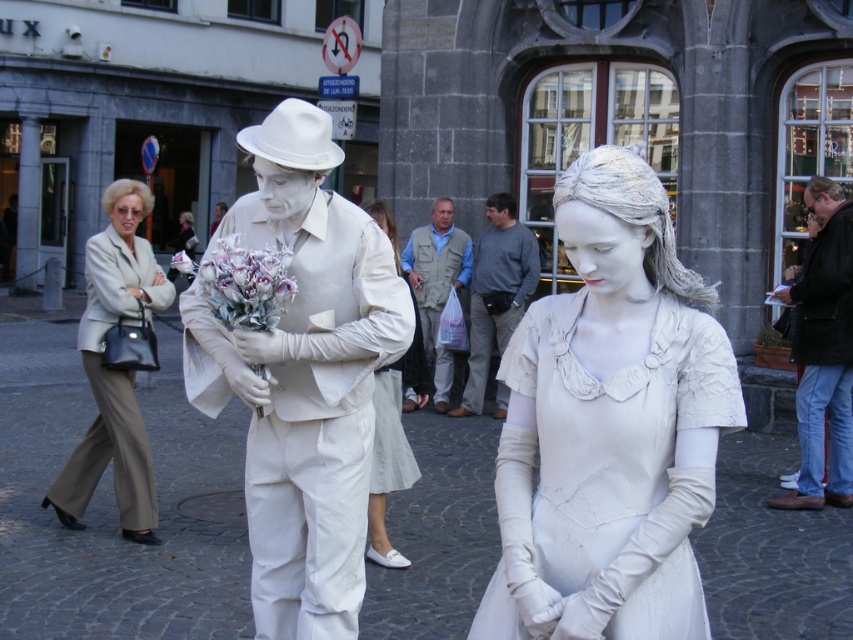
You are an artist planning to install a new sculpture in the urban area shown. You need to ensure that the new sculpture will not block the view of the white fabric dress at center from the street. Given that the existing white matte sculpture at center is already in place, will the new sculpture, if placed between them, obstruct the view of the dress?

The white matte sculpture at center is taller than the white fabric dress at center. If the new sculpture is placed between them, it may block the view of the dress if it is as tall or taller than the dress. However, since the existing sculpture is already taller, the new one might not necessarily block it further unless it is positioned directly in front. The answer depends on the exact placement and height of the new sculpture.

You are an artist planning to sketch the scene. You need to know the relative positions of the matte white statue at center and the purple silk bouquet at center. Which one is positioned lower in the image?

The matte white statue at center is positioned lower than the purple silk bouquet at center.

You are a photographer positioned at the end of the cobblestone street. You want to take a photo that includes both the matte white statue at center and the purple silk bouquet at center. Which object will appear closer to the camera in the photo?

The matte white statue at center will appear closer to the camera in the photo because it is positioned further to the viewer than the purple silk bouquet at center.